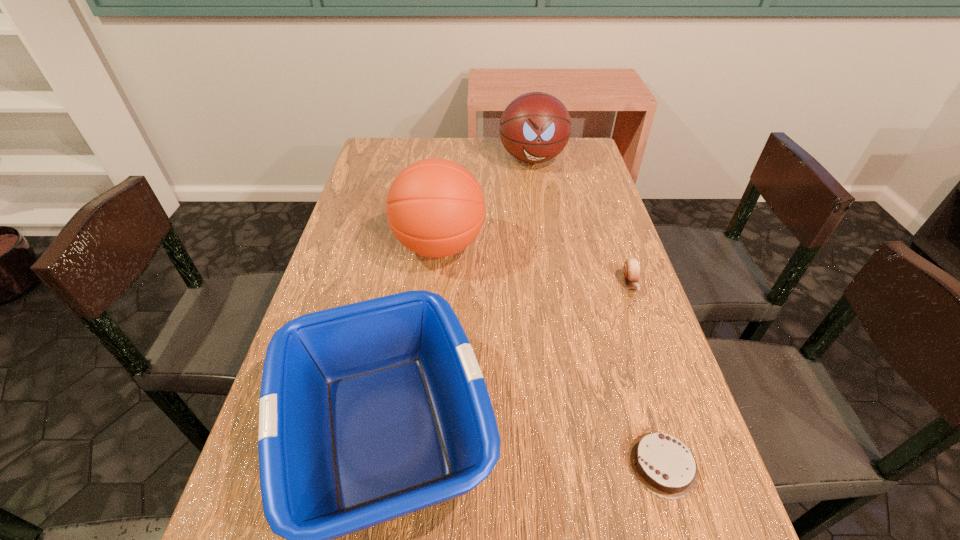
What are the coordinates of `free space between the shortest object and the farther basketball` in the screenshot? It's located at (598, 312).

You are a GUI agent. You are given a task and a screenshot of the screen. Output one action in this format:
    pyautogui.click(x=<x>, y=<y>)
    Task: Click on the unoccupied area between the escargot and the left basketball
    Image resolution: width=960 pixels, height=540 pixels.
    Given the screenshot: What is the action you would take?
    pyautogui.click(x=535, y=265)

I want to click on unoccupied area between the fourth tallest object and the left basketball, so click(535, 265).

Choose which object is the second nearest neighbor to the farther basketball. Please provide its 2D coordinates. Your answer should be formatted as a tuple, i.e. [(x, y)], where the tuple contains the x and y coordinates of a point satisfying the conditions above.

[(631, 268)]

Locate an element on the screen. The height and width of the screenshot is (540, 960). object that is the closest to the second shortest object is located at coordinates (662, 464).

What are the coordinates of `vacant space that satisfies the following two spatial constraints: 1. on the front side of the farthest object; 2. on the left side of the shortest object` in the screenshot? It's located at coord(584,464).